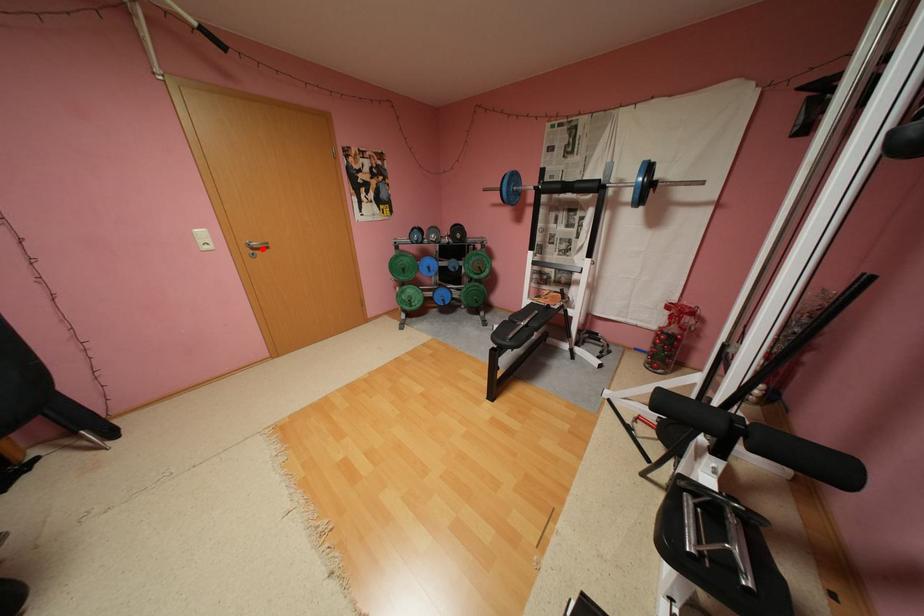
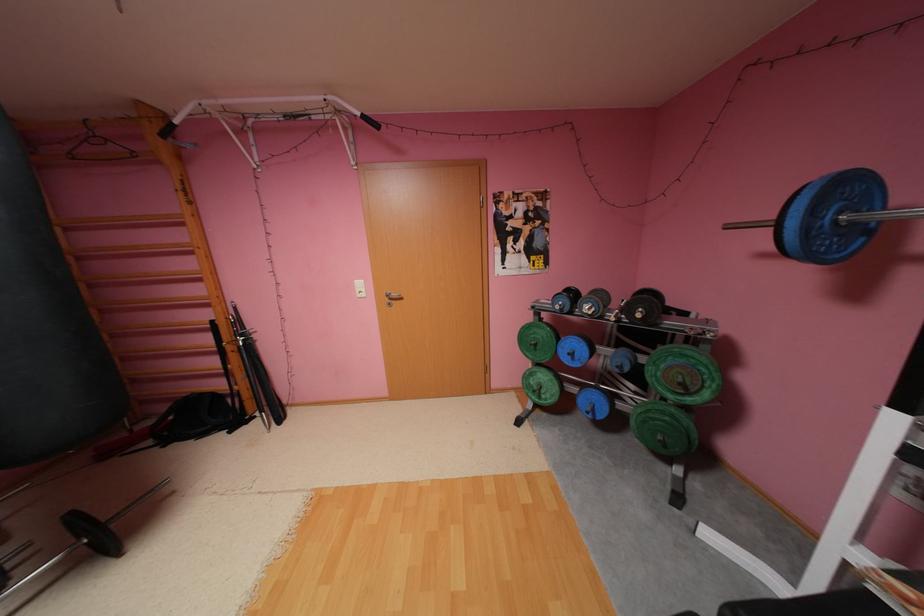
Find the pixel in the second image that matches the highlighted location in the first image.

(399, 299)